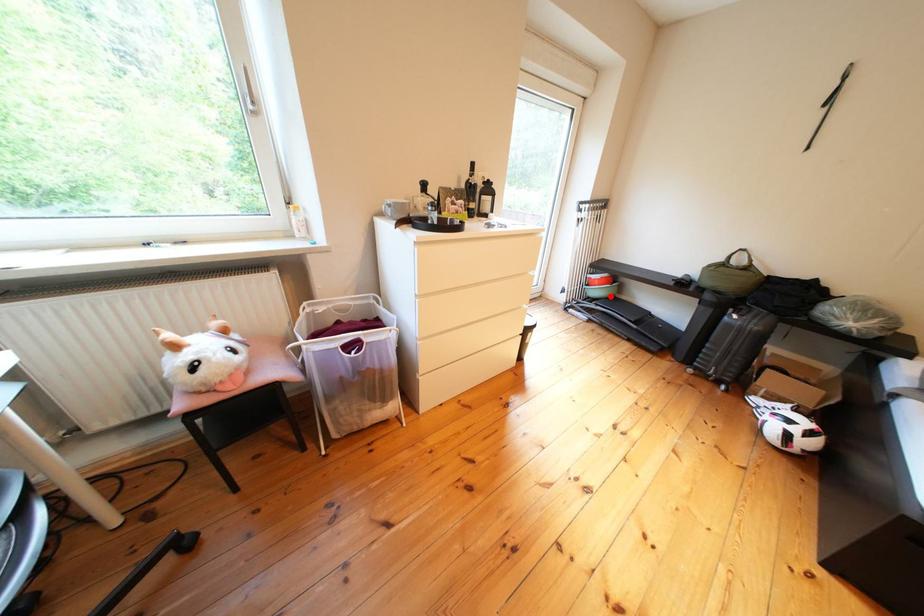
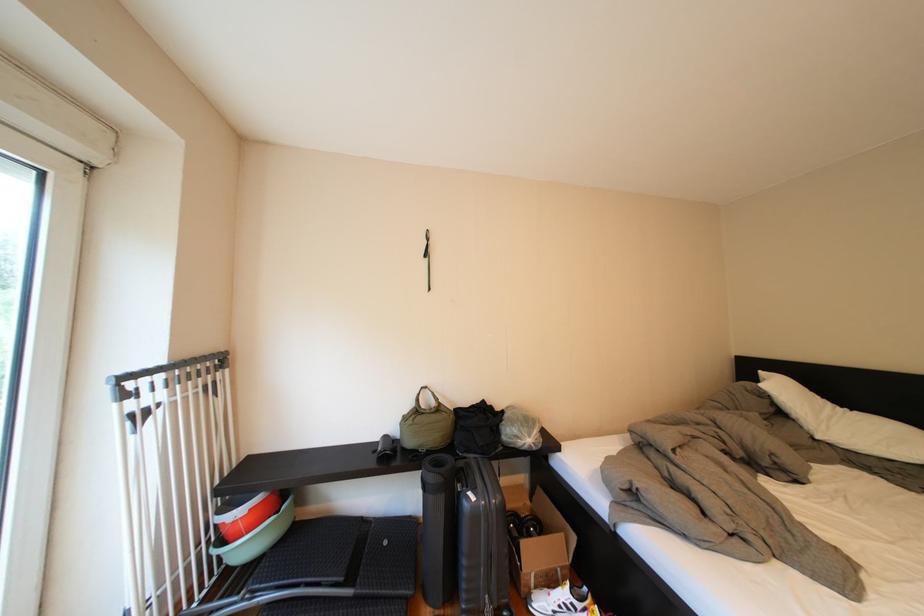
Question: I am providing you with two images of the same scene from different viewpoints. Image1 has a red point marked. In image2, the corresponding 3D location appears at what relative position? Reply with the corresponding letter.

Choices:
 (A) Closer
 (B) Farther

Answer: (B)